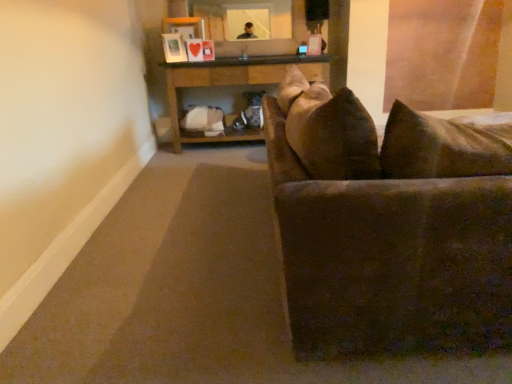
Question: In terms of width, does wooden table at center look wider or thinner when compared to brown fabric couch at right?

Choices:
 (A) thin
 (B) wide

Answer: (A)

Question: In the image, is wooden table at center positioned in front of or behind brown fabric couch at right?

Choices:
 (A) front
 (B) behind

Answer: (B)

Question: From a real-world perspective, relative to brown fabric couch at right, is wooden table at center vertically above or below?

Choices:
 (A) below
 (B) above

Answer: (A)

Question: Is point (392, 203) positioned closer to the camera than point (229, 79)?

Choices:
 (A) farther
 (B) closer

Answer: (B)

Question: From their relative heights in the image, would you say brown fabric couch at right is taller or shorter than wooden table at center?

Choices:
 (A) tall
 (B) short

Answer: (A)

Question: In the image, is brown fabric couch at right on the left side or the right side of wooden table at center?

Choices:
 (A) right
 (B) left

Answer: (A)

Question: Is brown fabric couch at right inside or outside of wooden table at center?

Choices:
 (A) outside
 (B) inside

Answer: (A)